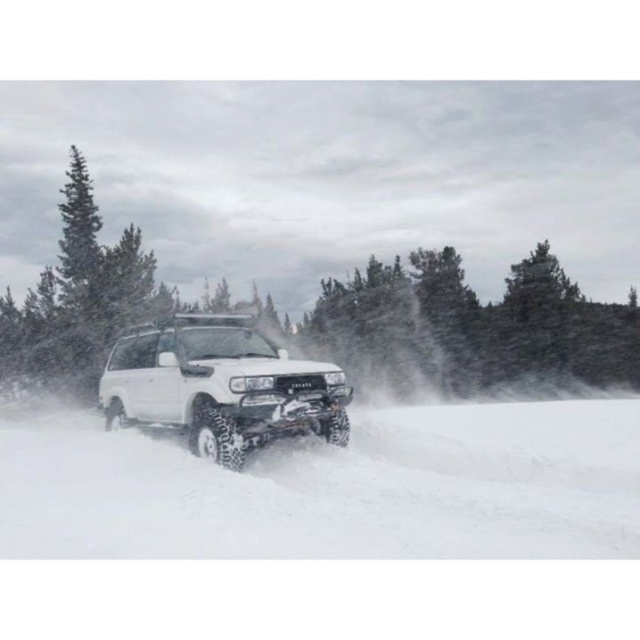
You are a photographer trying to capture the white Toyota Land Cruiser driving through deep snow. You notice a white fluffy snow at center located at point (x=339, y=488). Where should you position your camera to ensure the white fluffy snow at center is in the center of your photo?

To ensure the white fluffy snow at center is in the center of your photo, position your camera so that the point (x=339, y=488) is aligned with the center of your viewfinder or screen.